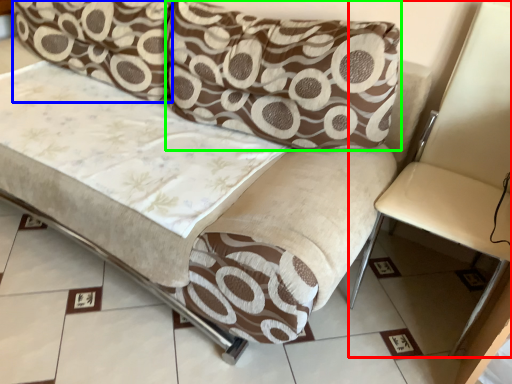
Question: Which is nearer to the armchair (highlighted by a red box)? pillow (highlighted by a blue box) or pillow (highlighted by a green box).

Choices:
 (A) pillow
 (B) pillow

Answer: (B)